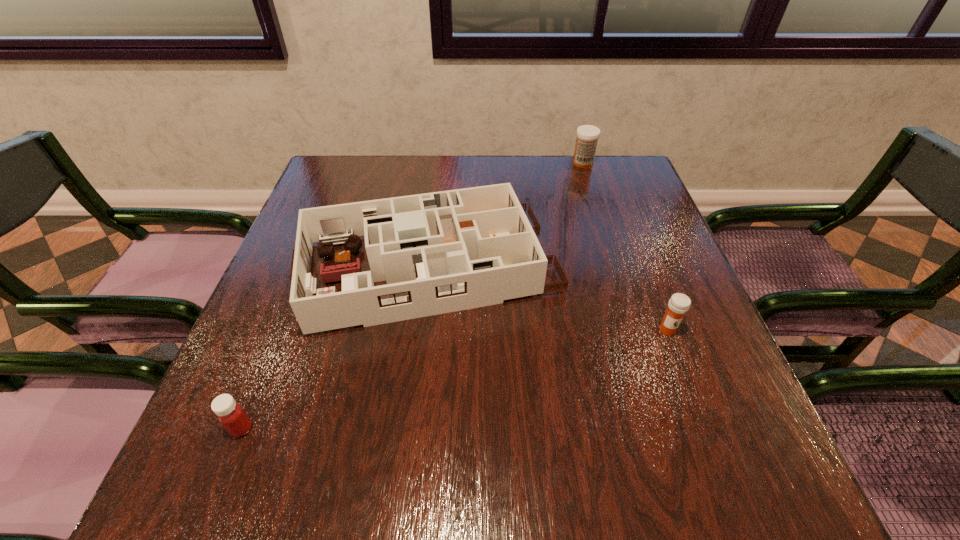
The width and height of the screenshot is (960, 540). I want to click on vacant space positioned 0.120m on the back of the nearest medicine, so (x=270, y=359).

You are a GUI agent. You are given a task and a screenshot of the screen. Output one action in this format:
    pyautogui.click(x=<x>, y=<y>)
    Task: Click on the object at the far edge
    The image size is (960, 540).
    Given the screenshot: What is the action you would take?
    pyautogui.click(x=587, y=136)

Where is `dollhouse at the left edge`? dollhouse at the left edge is located at coordinates (440, 252).

Identify the location of medicine that is positioned at the left edge. (231, 415).

The height and width of the screenshot is (540, 960). In order to click on object that is at the far right corner in this screenshot , I will do (x=587, y=136).

In the image, there is a desktop. Where is `vacant space at the far edge`? Image resolution: width=960 pixels, height=540 pixels. vacant space at the far edge is located at coordinates (485, 174).

Identify the location of vacant space at the left edge of the desktop. (313, 253).

Locate an element on the screen. vacant space at the right edge is located at coordinates (638, 212).

Where is `vacant space at the far left corner`? The image size is (960, 540). vacant space at the far left corner is located at coordinates (338, 178).

In the image, there is a desktop. Identify the location of blank space at the near left corner. The image size is (960, 540). pos(252,484).